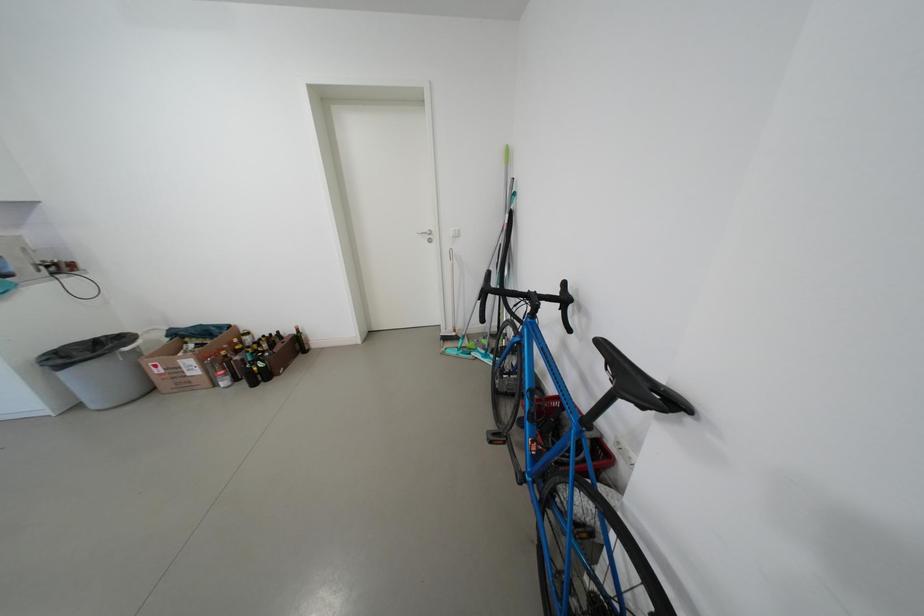
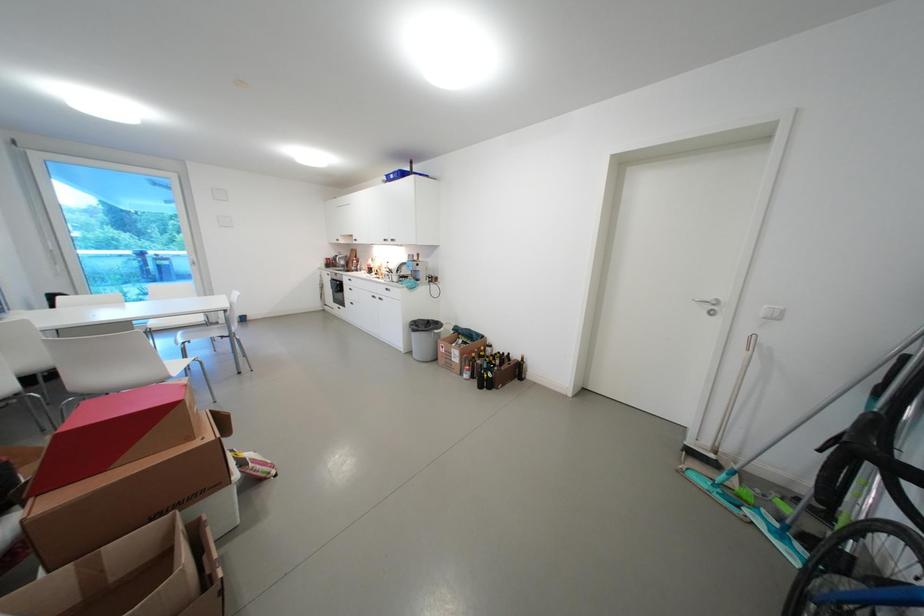
Question: Based on the continuous images, in which direction is the camera rotating? Reply with the corresponding letter.

Choices:
 (A) Left
 (B) Right
 (C) Up
 (D) Down

Answer: (A)